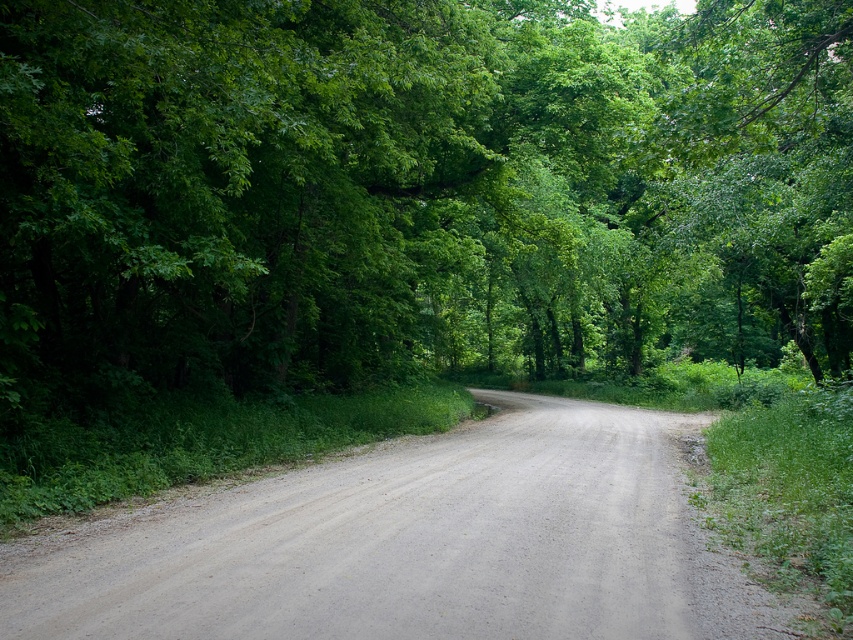
Question: Which object is farther from the camera taking this photo?

Choices:
 (A) gray gravel road at center
 (B) green leafy tree at center

Answer: (B)

Question: From the image, what is the correct spatial relationship of green leafy tree at center in relation to gray gravel road at center?

Choices:
 (A) left
 (B) right

Answer: (B)

Question: Can you confirm if green leafy tree at center is positioned to the right of gray gravel road at center?

Choices:
 (A) yes
 (B) no

Answer: (A)

Question: Which object appears closest to the camera in this image?

Choices:
 (A) green leafy tree at center
 (B) gray gravel road at center

Answer: (B)

Question: Does green leafy tree at center come in front of gray gravel road at center?

Choices:
 (A) no
 (B) yes

Answer: (A)